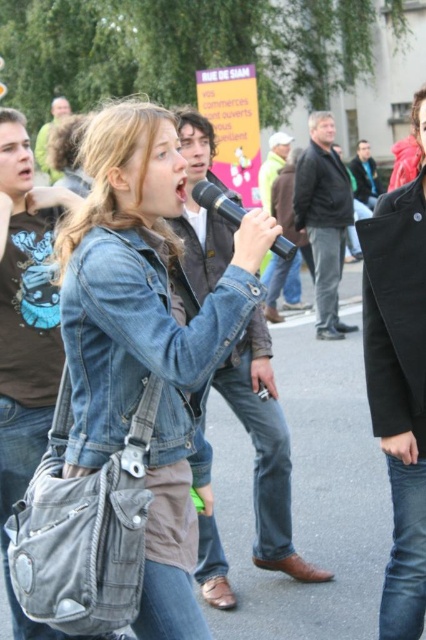
How far apart are brushed metal shirt at center and dark gray leather jacket at center?

brushed metal shirt at center is 26.09 feet from dark gray leather jacket at center.

Is point (28, 337) positioned in front of point (310, 166)?

Yes, it is in front of point (310, 166).

Does point (28, 212) come behind point (351, 214)?

No.

Locate an element on the screen. The width and height of the screenshot is (426, 640). brushed metal shirt at center is located at coordinates (25, 332).

Is dark gray leather jacket at center positioned at the back of black matte microphone at center?

Yes, it is.

Find the location of `dark gray leather jacket at center`. dark gray leather jacket at center is located at coordinates (324, 218).

Which is below, brown leather jacket at center or brushed metal shirt at center?

brown leather jacket at center

Between point (256, 449) and point (39, 269), which one is positioned behind?

Point (256, 449)

Between point (210, 244) and point (43, 310), which one is positioned behind?

Positioned behind is point (210, 244).

At what (x,y) coordinates should I click in order to perform the action: click on brown leather jacket at center. Please return your answer as a coordinate pair (x, y). This screenshot has height=640, width=426. Looking at the image, I should click on (264, 449).